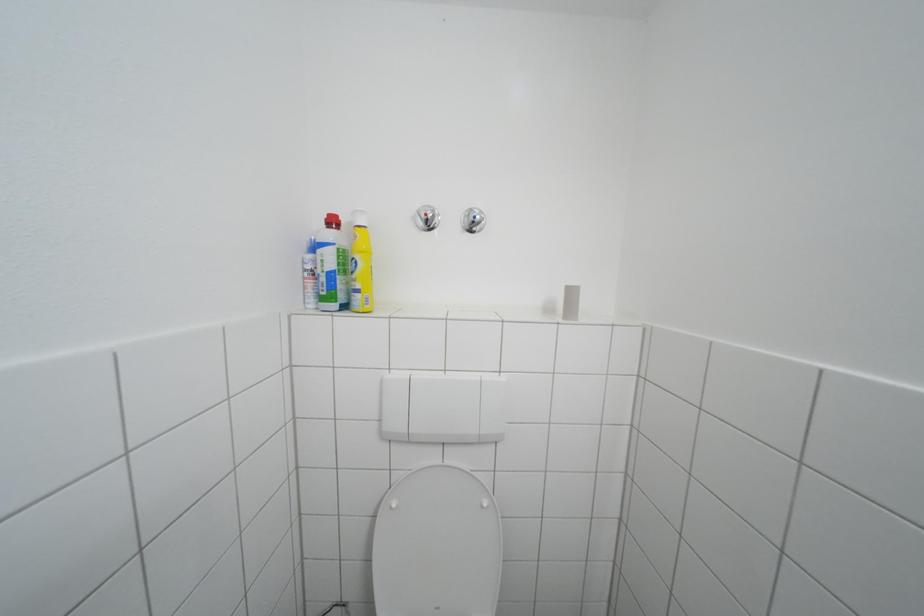
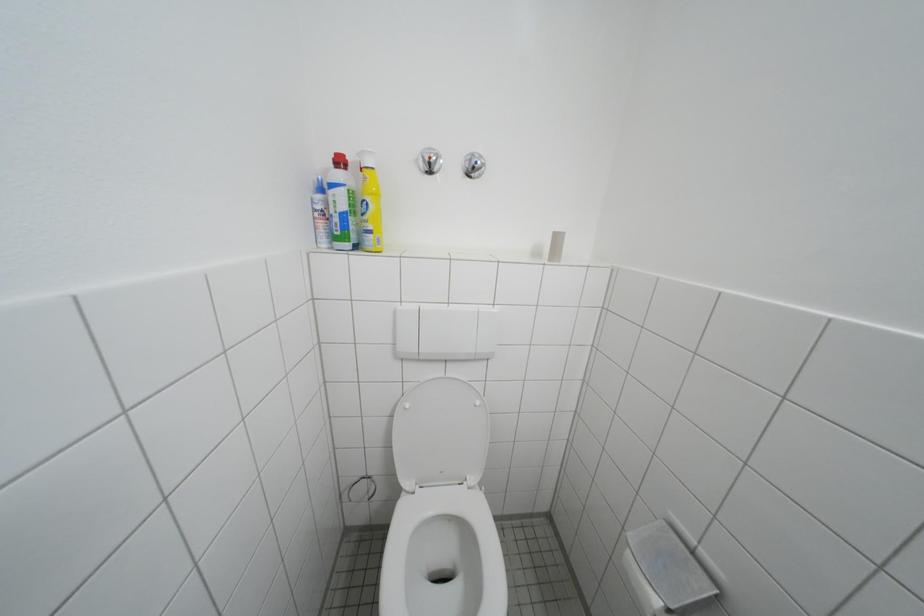
Question: The images are taken continuously from a first-person perspective. In which direction is your viewpoint rotating?

Choices:
 (A) Left
 (B) Right
 (C) Up
 (D) Down

Answer: (D)